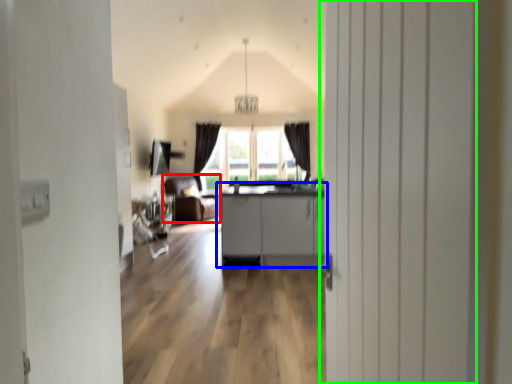
Question: Which object is positioned closest to armchair (highlighted by a red box)? Select from cabinetry (highlighted by a blue box) and door (highlighted by a green box).

Choices:
 (A) cabinetry
 (B) door

Answer: (A)